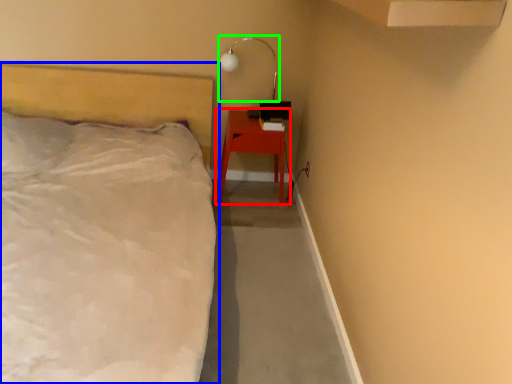
Question: Which object is positioned closest to nightstand (highlighted by a red box)? Select from bed (highlighted by a blue box) and lamp (highlighted by a green box).

Choices:
 (A) bed
 (B) lamp

Answer: (B)